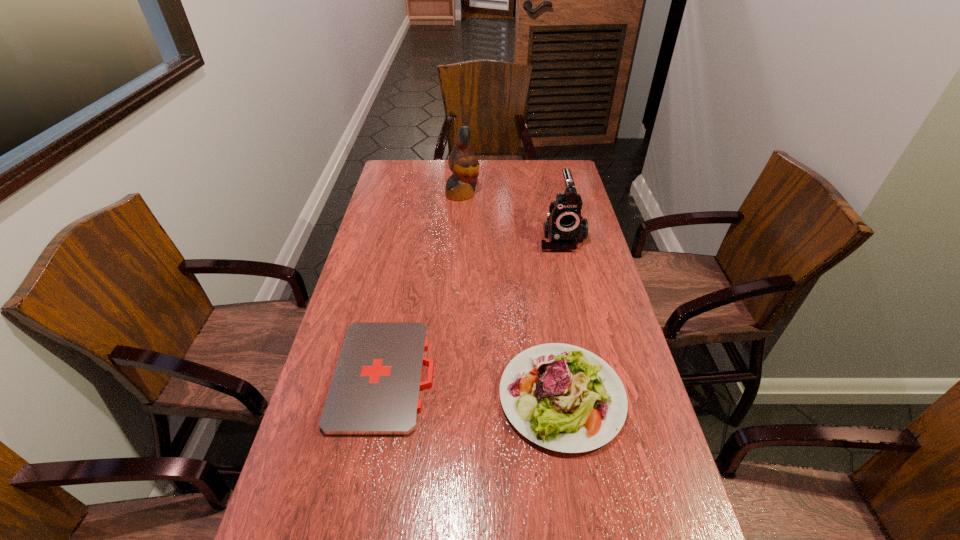
Locate an element on the screen. vacant space in between the camcorder and the tallest object is located at coordinates (512, 215).

Locate an element on the screen. The height and width of the screenshot is (540, 960). empty location between the third shortest object and the shortest object is located at coordinates (472, 306).

Find the location of `blank region between the camcorder and the parrot`. blank region between the camcorder and the parrot is located at coordinates (512, 215).

Where is `vacant area that lies between the first-aid kit and the camcorder`? vacant area that lies between the first-aid kit and the camcorder is located at coordinates (472, 306).

Where is `vacant area between the salad plate and the first-aid kit`? The width and height of the screenshot is (960, 540). vacant area between the salad plate and the first-aid kit is located at coordinates (473, 386).

Locate an element on the screen. The image size is (960, 540). unoccupied area between the camcorder and the third tallest object is located at coordinates pos(562,317).

Locate an element on the screen. free space between the second shortest object and the shortest object is located at coordinates (473, 386).

Locate an element on the screen. vacant space that's between the shortest object and the tallest object is located at coordinates (423, 285).

Locate which object is the second closest to the third shortest object. Please provide its 2D coordinates. Your answer should be formatted as a tuple, i.e. [(x, y)], where the tuple contains the x and y coordinates of a point satisfying the conditions above.

[(562, 397)]

Identify the location of object that can be found as the third closest to the first-aid kit. The image size is (960, 540). (463, 163).